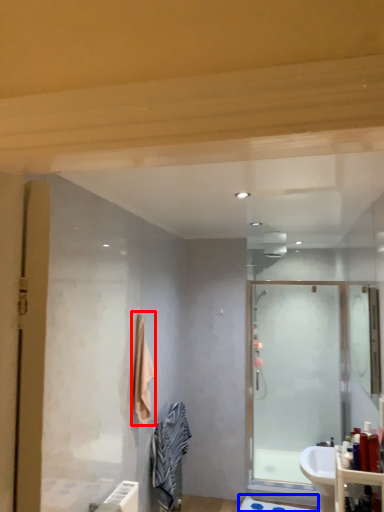
Question: Which point is closer to the camera, bath towel (highlighted by a red box) or bath mat (highlighted by a blue box)?

Choices:
 (A) bath towel
 (B) bath mat

Answer: (A)